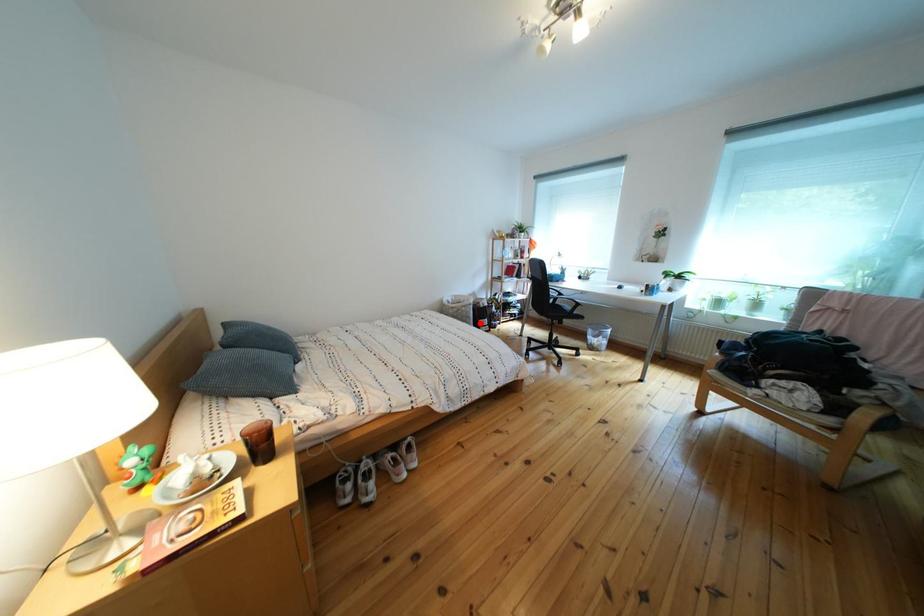
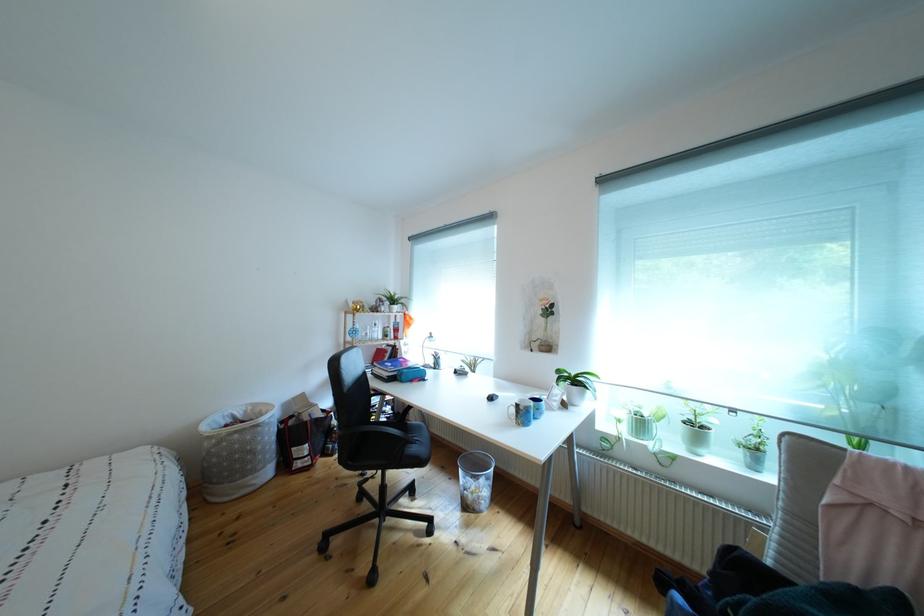
The point at the highlighted location is marked in the first image. Where is the corresponding point in the second image?

(263, 456)